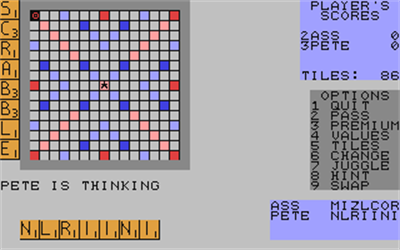
Where is `number of tiles`? number of tiles is located at coordinates (393, 75).